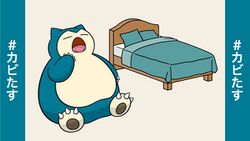
The image size is (250, 141). What are the coordinates of `blue pillow cases` in the screenshot? It's located at (130, 36), (149, 32).